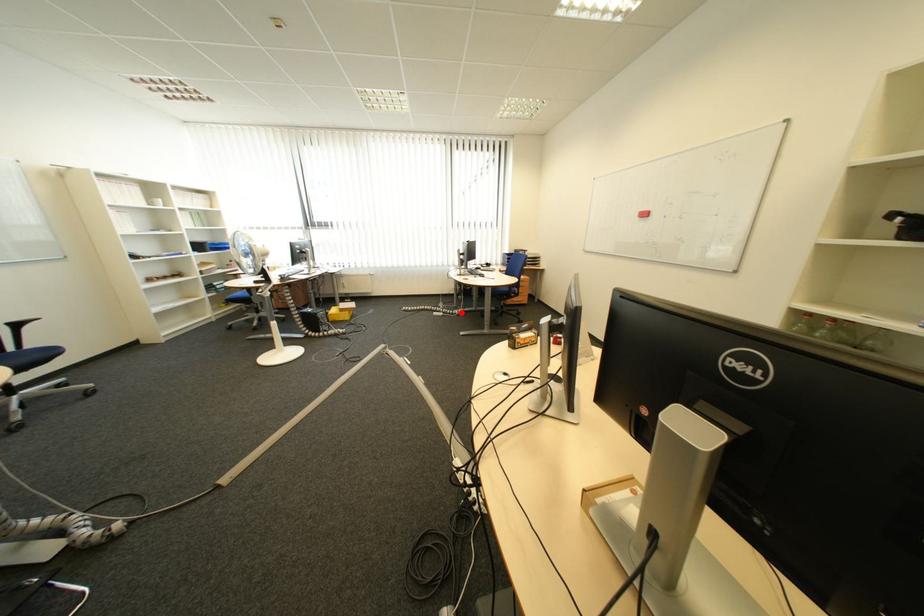
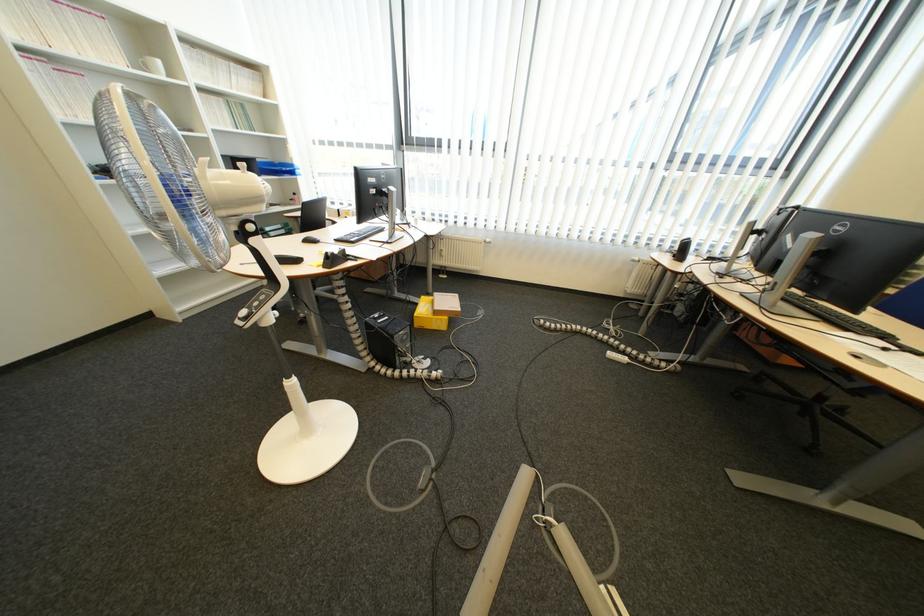
Question: I am providing you with two images of the same scene from different viewpoints. Given a red point in image1, look at the same physical point in image2. Is it:

Choices:
 (A) Closer to the viewpoint
 (B) Farther from the viewpoint

Answer: (B)